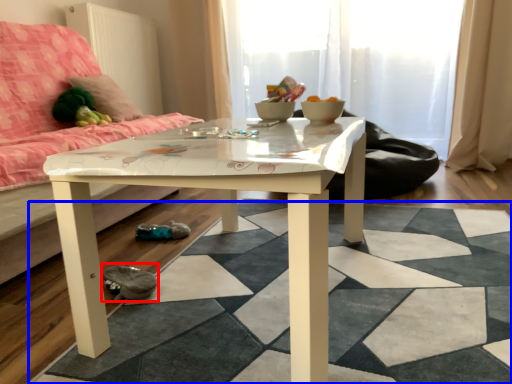
Question: Which point is further to the camera, shoe (highlighted by a red box) or square (highlighted by a blue box)?

Choices:
 (A) shoe
 (B) square

Answer: (A)